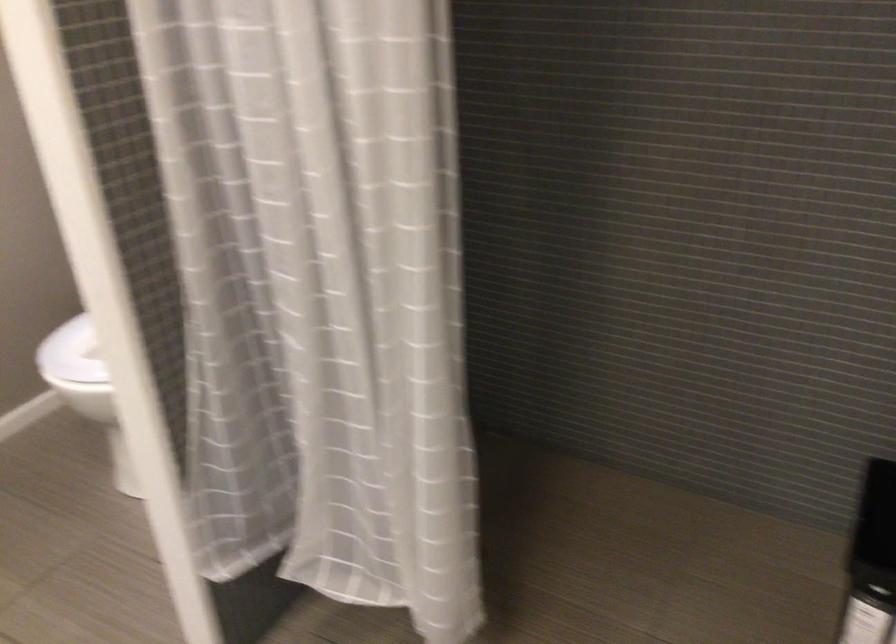
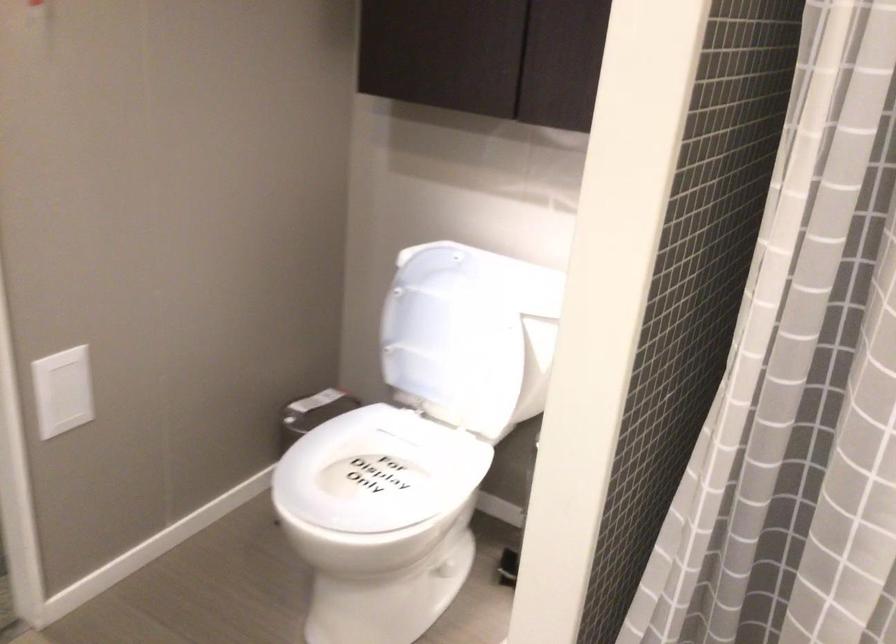
Question: Based on the continuous images, in which direction is the camera rotating? Reply with the corresponding letter.

Choices:
 (A) Left
 (B) Right
 (C) Up
 (D) Down

Answer: (C)